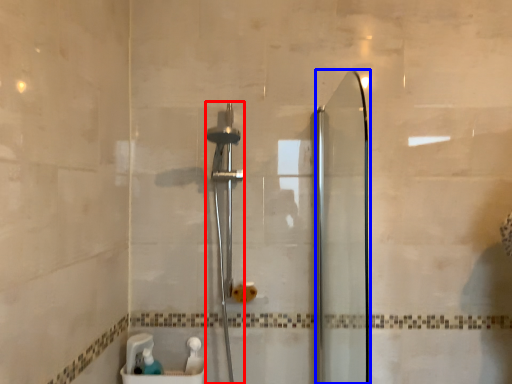
Question: Among these objects, which one is farthest to the camera, shower (highlighted by a red box) or screen door (highlighted by a blue box)?

Choices:
 (A) shower
 (B) screen door

Answer: (A)